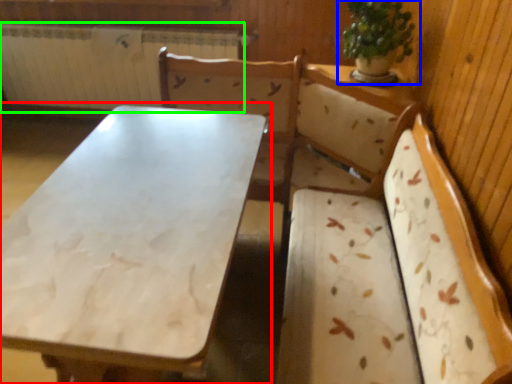
Question: Which object is the closest to the table (highlighted by a red box)? Choose among these: houseplant (highlighted by a blue box) or radiator (highlighted by a green box).

Choices:
 (A) houseplant
 (B) radiator

Answer: (A)